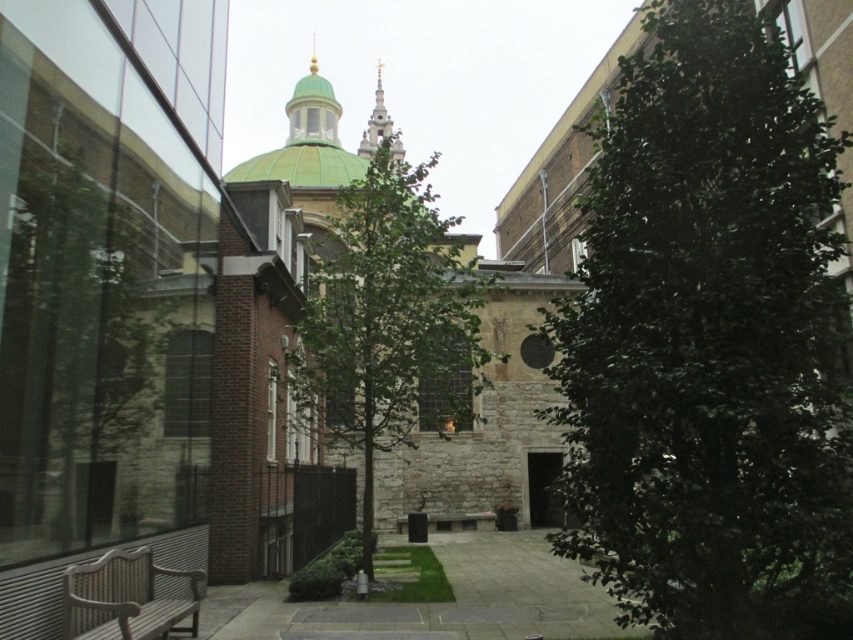
You are standing in the courtyard and want to walk towards the paved stone path at center. Which direction should you face if you are currently facing the green stone church at center?

Since the green stone church at center is to the left of the paved stone path at center, you should turn to your right to face the paved stone path at center.

You are standing in the courtyard and want to walk to the paved stone path at center. Which direction should you walk relative to the green stone church at center?

You should walk behind the green stone church at center to reach the paved stone path at center, as the paved stone path at center is located behind it according to the description.

You are a landscape architect designing a new pathway in the courtyard. You need to ensure that the new path will be at least 10 meters away from the green leafy tree at center to protect its roots. Can the existing paved stone path at center be used as the new path?

The distance between the green leafy tree at center and the paved stone path at center is 12.39 meters, which is more than the required 10 meters. Therefore, the existing paved stone path at center can be used as the new path without compromising the tree roots.